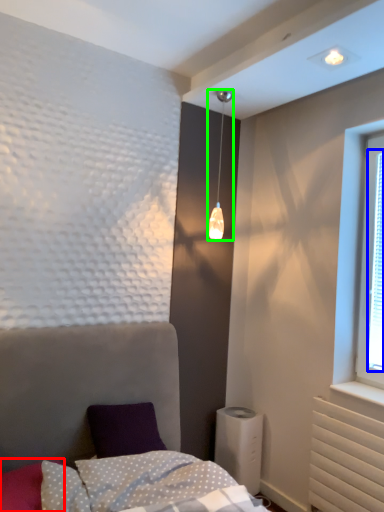
Question: Which is nearer to the pillow (highlighted by a red box)? window screen (highlighted by a blue box) or lamp (highlighted by a green box).

Choices:
 (A) window screen
 (B) lamp

Answer: (B)